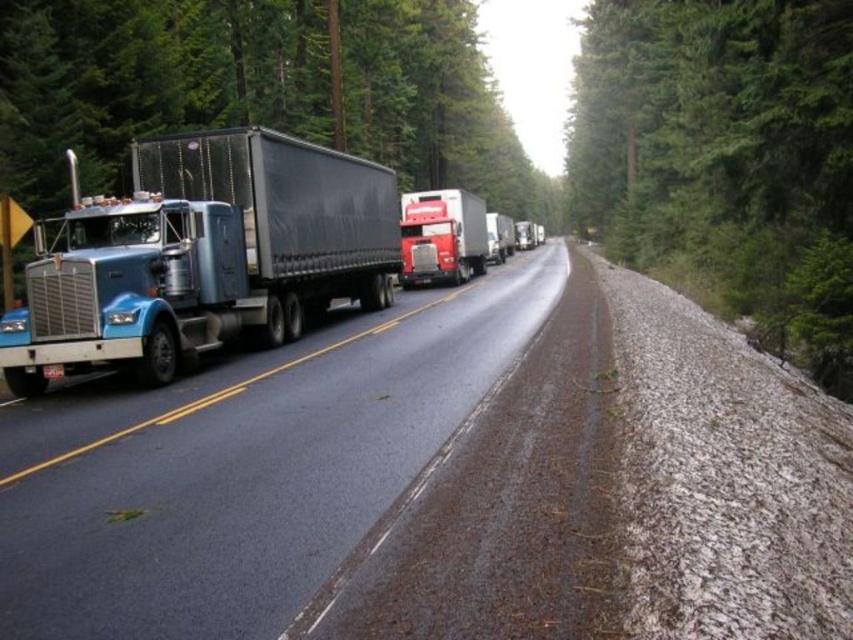
You are driving a car that is 15 feet long. You want to pass through the space between the black rubber highway at center and the green textured tree at right. Is there enough space for your car to fit through this gap?

The distance between the black rubber highway at center and the green textured tree at right is 73.87 feet, which is significantly larger than your car length of 15 feet. Therefore, there is ample space for your car to pass through the gap safely.